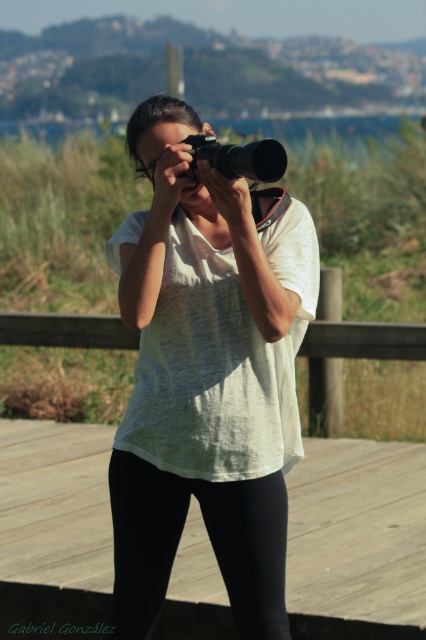
Question: Does wooden at center have a larger size compared to black leggings at lower center?

Choices:
 (A) no
 (B) yes

Answer: (B)

Question: Among these points, which one is nearest to the camera?

Choices:
 (A) (195, 476)
 (B) (74, 483)

Answer: (A)

Question: Does white matte shirt at center appear on the right side of matte black camera at center?

Choices:
 (A) no
 (B) yes

Answer: (A)

Question: Which object appears closest to the camera in this image?

Choices:
 (A) wooden at center
 (B) matte black camera at center
 (C) white matte shirt at center

Answer: (B)

Question: Which point is farther from the camera taking this photo?

Choices:
 (A) [x=213, y=156]
 (B) [x=276, y=218]
 (C) [x=270, y=579]

Answer: (B)

Question: Is white matte shirt at center bigger than matte black camera at center?

Choices:
 (A) no
 (B) yes

Answer: (A)